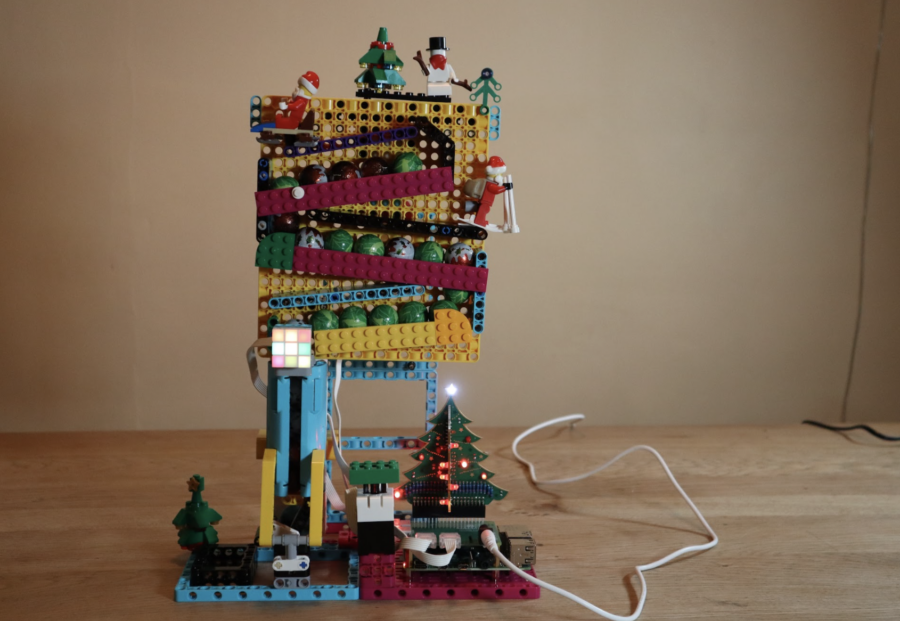
Locate an element on the screen. wood table is located at coordinates (x=784, y=533).